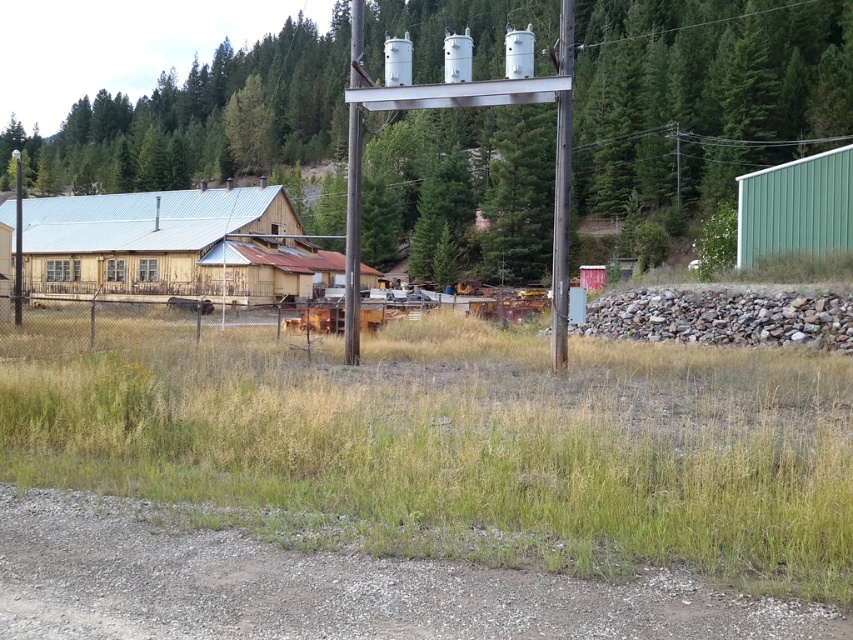
Question: Among these objects, which one is nearest to the camera?

Choices:
 (A) smooth gray pole at center
 (B) rusty metal cow at center

Answer: (A)

Question: Which is farther from the metallic gray pole at center?

Choices:
 (A) smooth gray pole at center
 (B) rusty metal cow at center

Answer: (B)

Question: Is metallic gray pole at center below smooth gray pole at center?

Choices:
 (A) yes
 (B) no

Answer: (A)

Question: Does green grass at center come in front of rusty metal cow at center?

Choices:
 (A) no
 (B) yes

Answer: (B)

Question: Which point appears farthest from the camera in this image?

Choices:
 (A) (282, 388)
 (B) (311, 328)
 (C) (349, 232)

Answer: (B)

Question: Does metallic gray pole at center have a larger size compared to rusty metal cow at center?

Choices:
 (A) yes
 (B) no

Answer: (A)